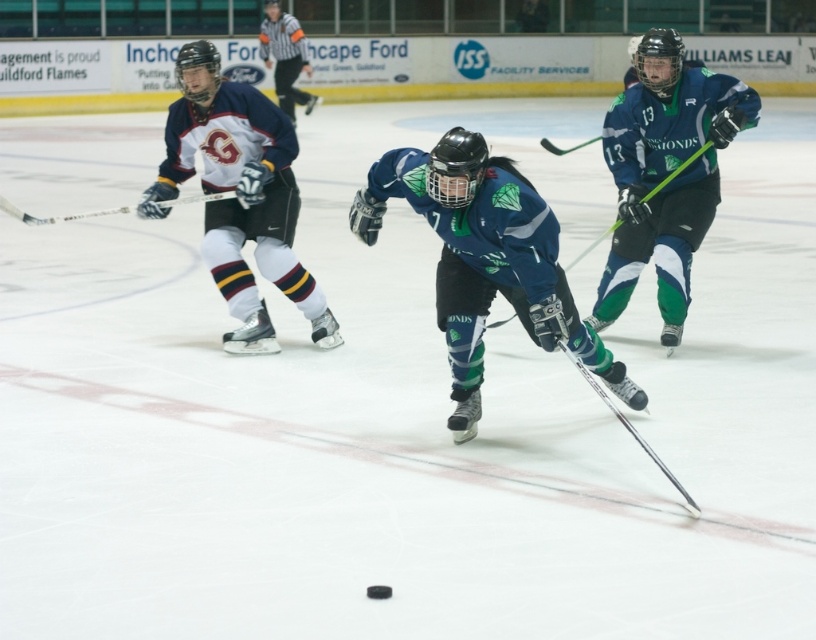
You are a referee watching the ice hockey game. You notice the shiny blue hockey stick at center and the white matte jersey at left. Which object is closer to you?

The shiny blue hockey stick at center is closer to you because it is in front of the white matte jersey at left.

You are a referee observing the ice hockey game. You notice the green matte hockey stick at right and the white jersey at upper center. Which object has a greater width in the image?

The green matte hockey stick at right has a greater width than the white jersey at upper center.